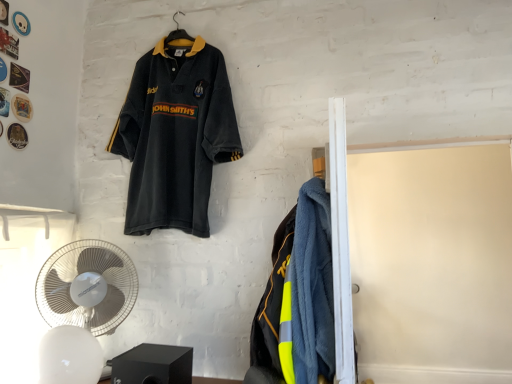
Question: In terms of width, does velvet-like dark blue polo shirt at upper left look wider or thinner when compared to white plastic fan at lower left, the 1th mechanical fan in the back-to-front sequence?

Choices:
 (A) thin
 (B) wide

Answer: (B)

Question: From the image's perspective, is velvet-like dark blue polo shirt at upper left above or below white plastic fan at lower left, the 1th mechanical fan in the back-to-front sequence?

Choices:
 (A) below
 (B) above

Answer: (B)

Question: Which is nearer to the white plastic fan at lower left, the 1th mechanical fan in the back-to-front sequence?

Choices:
 (A) white plastic mechanical fan at lower left, the 1th mechanical fan from the front
 (B) velvet-like dark blue polo shirt at upper left

Answer: (A)

Question: Which of these objects is positioned farthest from the white plastic mechanical fan at lower left, the 1th mechanical fan from the front?

Choices:
 (A) velvet-like dark blue polo shirt at upper left
 (B) white plastic fan at lower left, the 1th mechanical fan in the back-to-front sequence

Answer: (A)